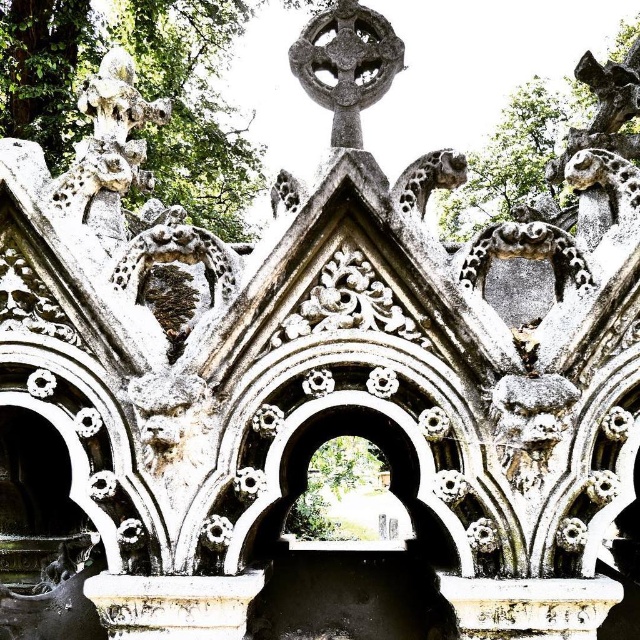
You are an architect examining the stone structure. You notice the white stone dragon at upper left and the gray stone cross at upper center. Which object is positioned to the left of the other?

The white stone dragon at upper left is positioned to the left of the gray stone cross at upper center.

You are an archaeologist examining the stone structure. You notice two points marked on the structure. The first point is at coordinates point [96,109] and the second is at point [339,26]. From your vantage point, which point is closer to you?

Point [339,26] is closer to you because point [96,109] is behind it.